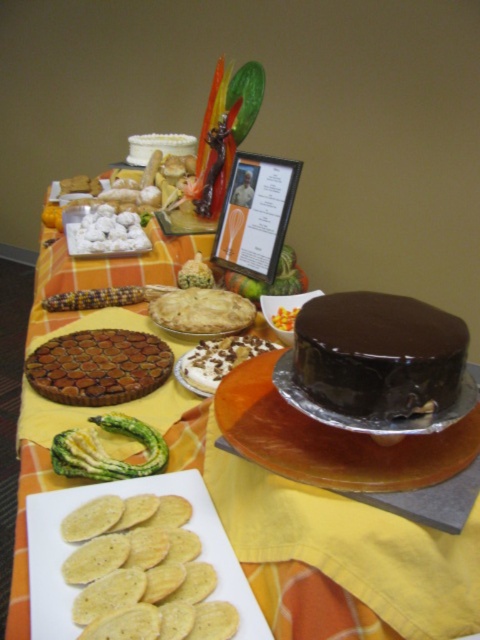
Can you confirm if chocolatesmoothcake at right is wider than white frosted cake at center?

In fact, chocolatesmoothcake at right might be narrower than white frosted cake at center.

Find the location of `chocolatesmoothcake at right`. chocolatesmoothcake at right is located at coordinates (379, 355).

Which is in front, point (369, 330) or point (179, 147)?

Point (369, 330) is in front.

Where is `chocolatesmoothcake at right`? chocolatesmoothcake at right is located at coordinates (379, 355).

Does chocolatesmoothcake at right have a smaller size compared to white creamy cake at center?

No.

Which is below, chocolatesmoothcake at right or white creamy cake at center?

white creamy cake at center

Locate an element on the screen. Image resolution: width=480 pixels, height=640 pixels. chocolatesmoothcake at right is located at coordinates (379, 355).

Between point (145, 621) and point (69, 378), which one is positioned in front?

Point (145, 621) is more forward.

Is golden cracker at center positioned in front of brown glossy tart at center-left?

Yes, it is in front of brown glossy tart at center-left.

Who is more distant from viewer, (x=157, y=540) or (x=85, y=352)?

The point (x=85, y=352) is behind.

You are a GUI agent. You are given a task and a screenshot of the screen. Output one action in this format:
    pyautogui.click(x=<x>, y=<y>)
    Task: Click on the golden cracker at center
    The height and width of the screenshot is (640, 480).
    Given the screenshot: What is the action you would take?
    pyautogui.click(x=144, y=566)